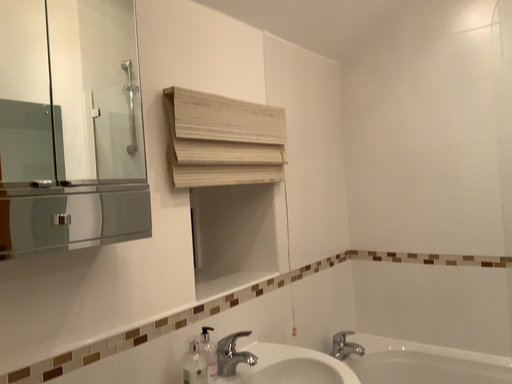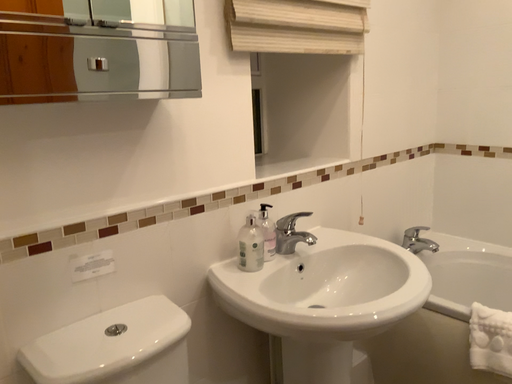
Question: Which way did the camera rotate in the video?

Choices:
 (A) rotated downward
 (B) rotated upward

Answer: (A)